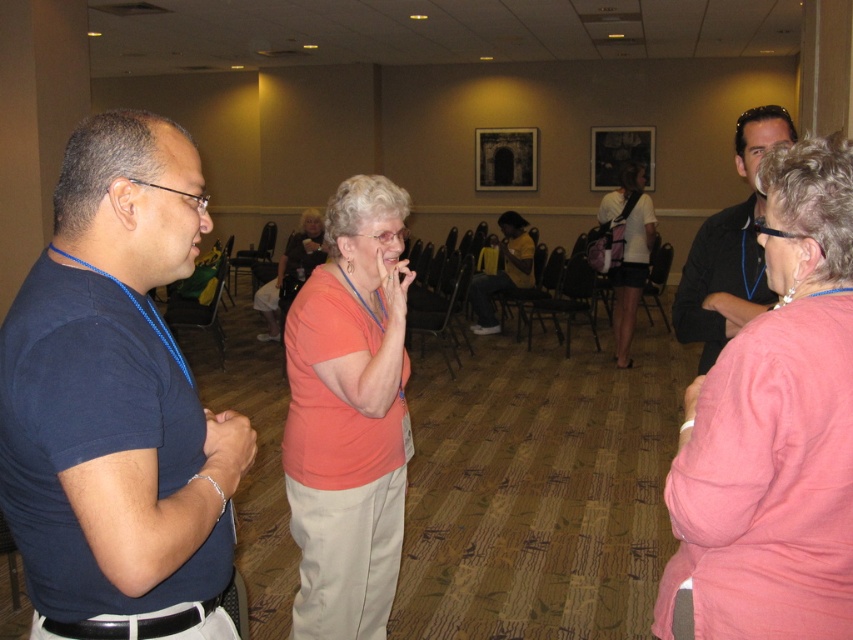
Looking at this image, between matte orange shirt at center and black matte shirt at right, which one appears on the left side from the viewer's perspective?

matte orange shirt at center

In the scene shown: Between matte orange shirt at center and black matte shirt at right, which one has less height?

black matte shirt at right

What do you see at coordinates (349, 417) in the screenshot?
I see `matte orange shirt at center` at bounding box center [349, 417].

You are a GUI agent. You are given a task and a screenshot of the screen. Output one action in this format:
    pyautogui.click(x=<x>, y=<y>)
    Task: Click on the matte orange shirt at center
    The width and height of the screenshot is (853, 640).
    Given the screenshot: What is the action you would take?
    pyautogui.click(x=349, y=417)

Between pink fabric backpack at center and orange matte shirt at center, which one appears on the left side from the viewer's perspective?

orange matte shirt at center is more to the left.

Who is higher up, pink fabric backpack at center or orange matte shirt at center?

Positioned higher is pink fabric backpack at center.

Who is more forward, (x=653, y=232) or (x=277, y=268)?

Positioned in front is point (x=653, y=232).

This screenshot has width=853, height=640. What are the coordinates of `pink fabric backpack at center` in the screenshot? It's located at (628, 256).

Is pink fabric shirt at center above matte orange shirt at center?

Yes.

Does pink fabric shirt at center appear under matte orange shirt at center?

No.

Locate an element on the screen. The image size is (853, 640). pink fabric shirt at center is located at coordinates (775, 432).

Where is `pink fabric shirt at center`? The height and width of the screenshot is (640, 853). pink fabric shirt at center is located at coordinates (775, 432).